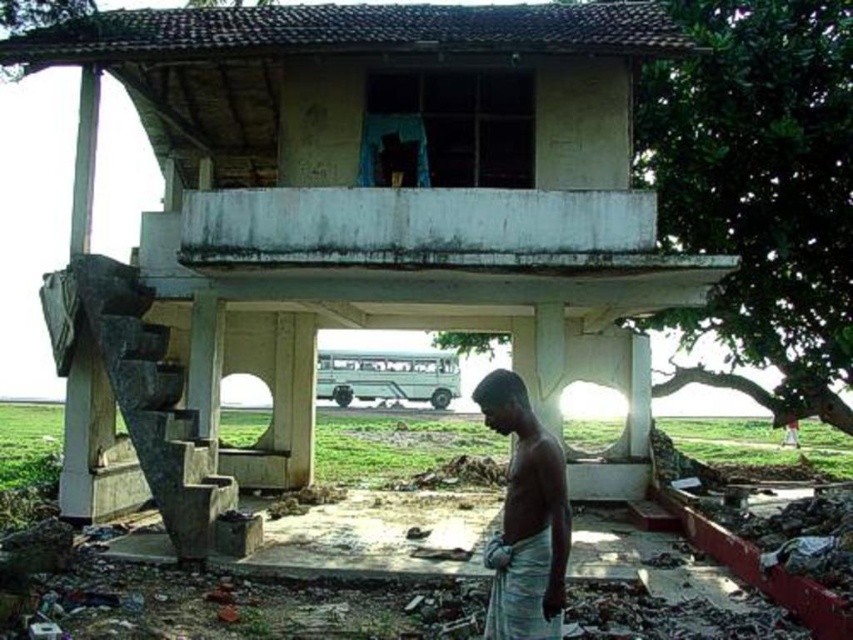
Does light brown cloth at center come in front of green leafy tree at center?

That is True.

Measure the distance between light brown cloth at center and green leafy tree at center.

light brown cloth at center and green leafy tree at center are 37.64 feet apart from each other.

Locate an element on the screen. light brown cloth at center is located at coordinates (525, 518).

Who is more distant from viewer, (770,154) or (495,548)?

Positioned behind is point (770,154).

Measure the distance between point (827, 70) and camera.

Point (827, 70) is 38.18 feet away from camera.

Who is more forward, (804,337) or (556,634)?

Positioned in front is point (556,634).

Where is `green leafy tree at upper right`? Image resolution: width=853 pixels, height=640 pixels. green leafy tree at upper right is located at coordinates (759, 189).

This screenshot has width=853, height=640. Describe the element at coordinates (759, 189) in the screenshot. I see `green leafy tree at upper right` at that location.

Who is more distant from viewer, (769, 227) or (486, 349)?

Positioned behind is point (486, 349).

Where is `green leafy tree at upper right`? The image size is (853, 640). green leafy tree at upper right is located at coordinates (759, 189).